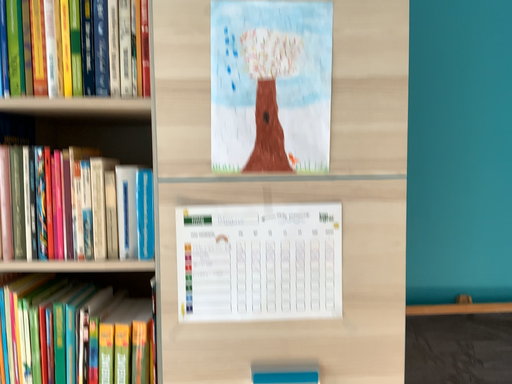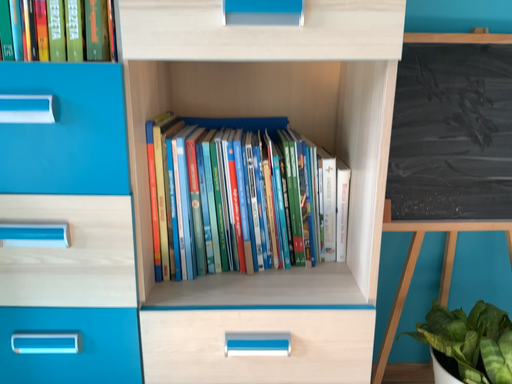
Question: How did the camera likely rotate when shooting the video?

Choices:
 (A) rotated downward
 (B) rotated upward

Answer: (A)